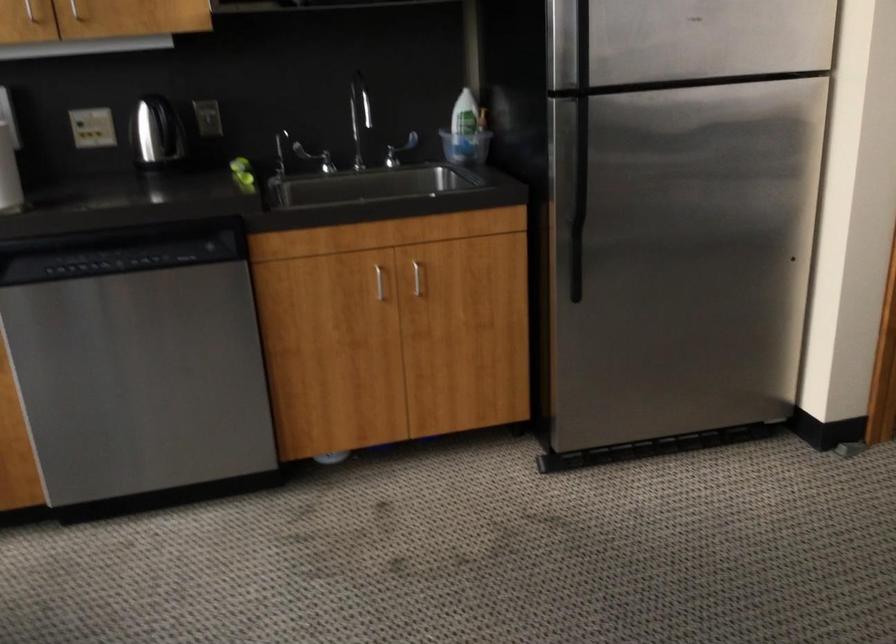
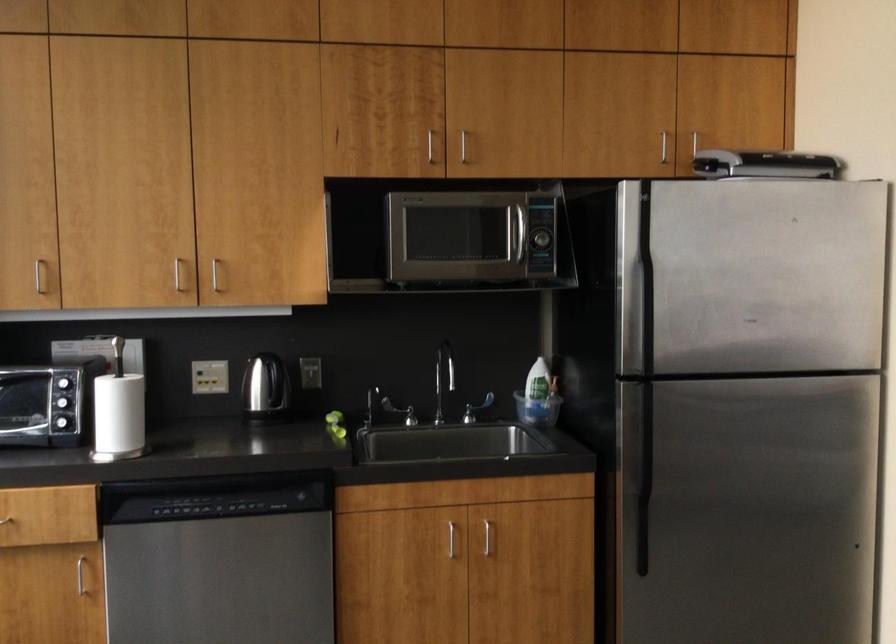
In the second image, find the point that corresponds to point 101,225 in the first image.

(208, 471)